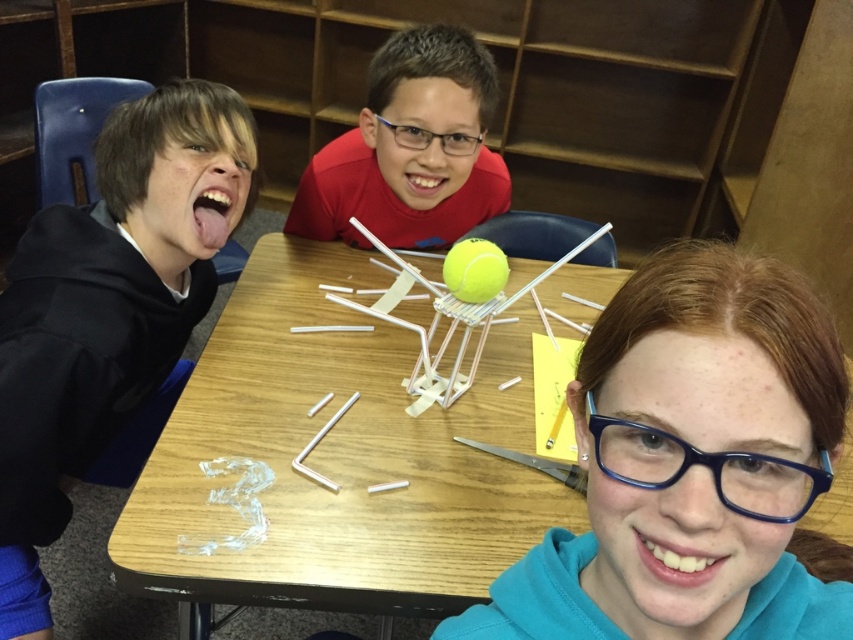
Does point (177, 499) come in front of point (432, 172)?

Yes, it is in front of point (432, 172).

Can you confirm if wooden table at center is positioned above matte red shirt at center?

Incorrect, wooden table at center is not positioned above matte red shirt at center.

Is point (273, 305) behind point (303, 176)?

No, it is not.

Image resolution: width=853 pixels, height=640 pixels. I want to click on wooden table at center, so click(338, 458).

Does wooden table at center lie in front of black hoodie at left?

Yes, it is.

Is point (349, 573) closer to viewer compared to point (166, 232)?

Yes.

The image size is (853, 640). Identify the location of wooden table at center. (338, 458).

Is blue plastic hair at center to the left of black hoodie at left from the viewer's perspective?

Incorrect, blue plastic hair at center is not on the left side of black hoodie at left.

From the picture: Does blue plastic hair at center come behind black hoodie at left?

That is False.

Which is in front, point (476, 634) or point (215, 182)?

Point (476, 634)

This screenshot has width=853, height=640. I want to click on blue plastic hair at center, so click(688, 464).